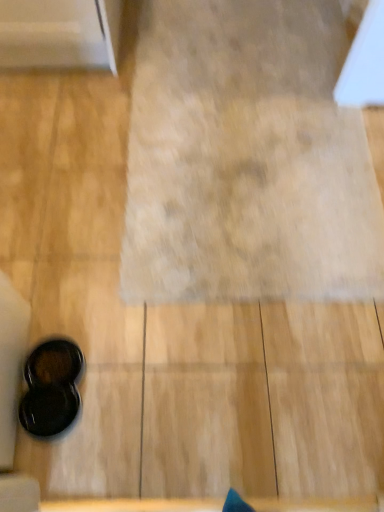
Image resolution: width=384 pixels, height=512 pixels. In order to click on black rubber shoe at lower left in this screenshot , I will do `click(51, 388)`.

What do you see at coordinates (51, 388) in the screenshot? This screenshot has width=384, height=512. I see `black rubber shoe at lower left` at bounding box center [51, 388].

You are a GUI agent. You are given a task and a screenshot of the screen. Output one action in this format:
    pyautogui.click(x=<x>, y=<y>)
    Task: Click on the black rubber shoe at lower left
    
    Given the screenshot: What is the action you would take?
    pyautogui.click(x=51, y=388)